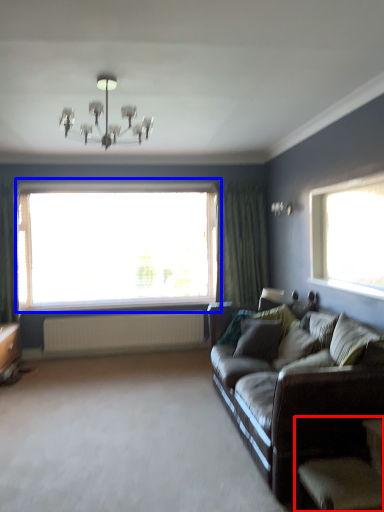
Question: Which point is closer to the camera, armchair (highlighted by a red box) or window (highlighted by a blue box)?

Choices:
 (A) armchair
 (B) window

Answer: (A)